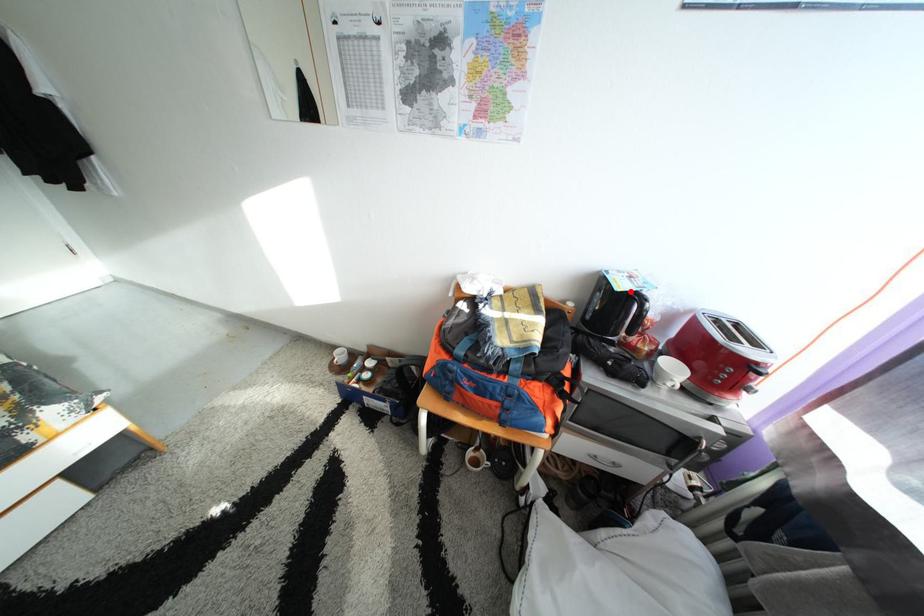
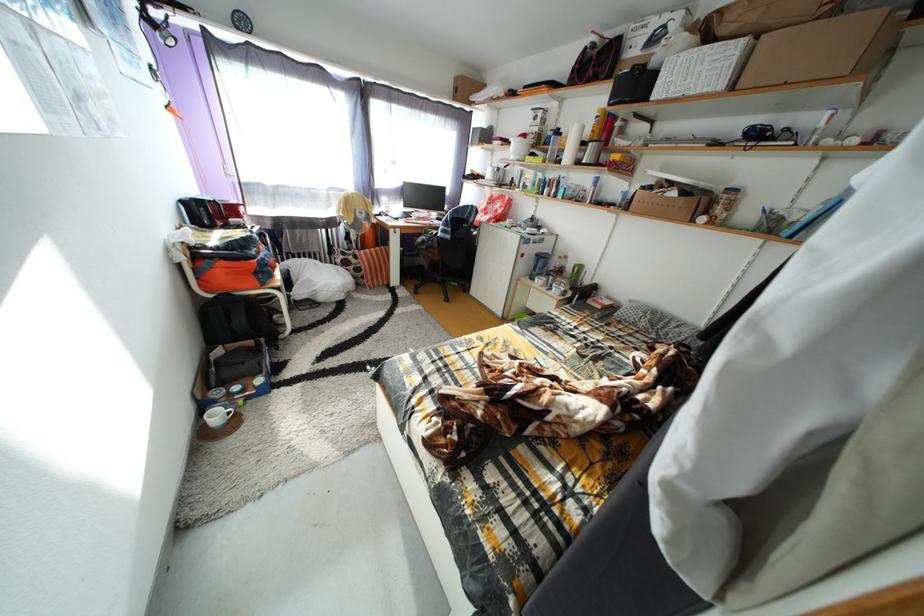
Question: I am providing you with two images of the same scene from different viewpoints. A red point is marked on the first image. Is the red point's position out of view in image 2?

Choices:
 (A) Yes
 (B) No

Answer: (A)